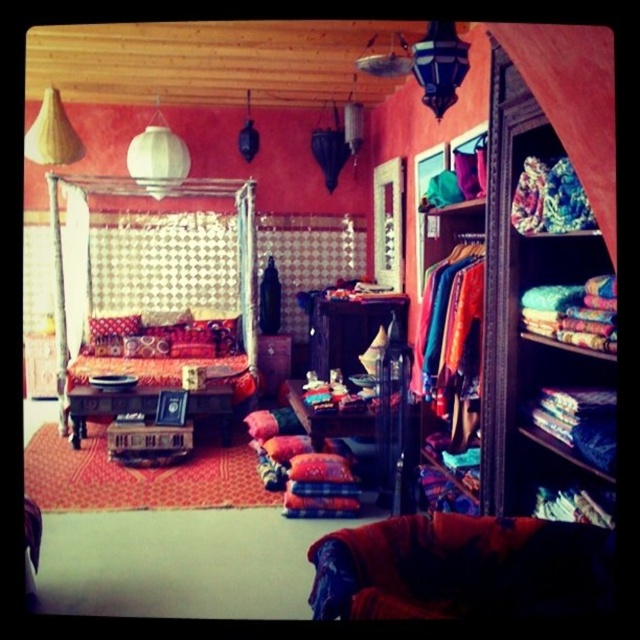
Question: Is textured fabric bed at center above white sheer curtain at left?

Choices:
 (A) yes
 (B) no

Answer: (A)

Question: Which point is closer to the camera?

Choices:
 (A) coord(52,216)
 (B) coord(72,330)

Answer: (A)

Question: Is textured fabric bed at center positioned at the back of white sheer curtain at left?

Choices:
 (A) yes
 (B) no

Answer: (B)

Question: Is textured fabric bed at center thinner than white sheer curtain at left?

Choices:
 (A) no
 (B) yes

Answer: (A)